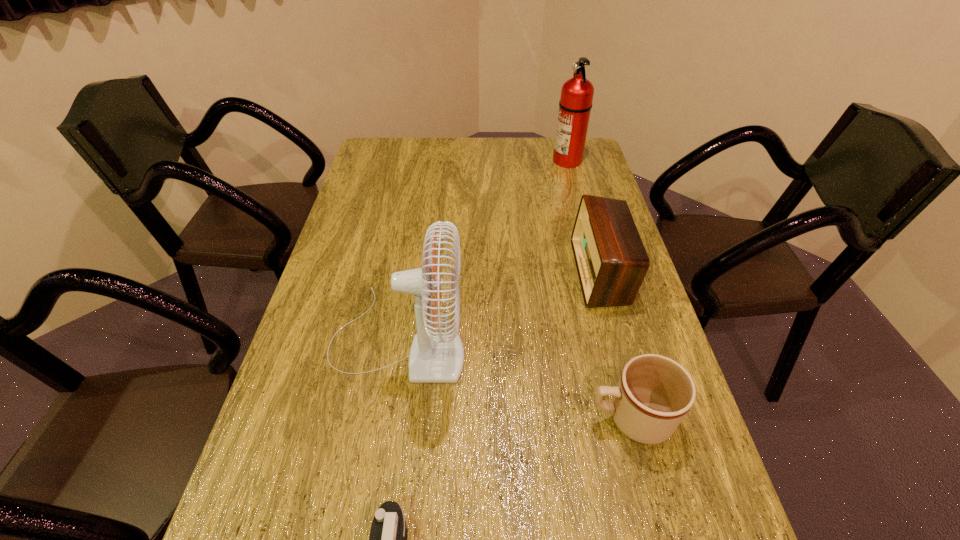
Where is `vacant point located 0.390m on the front-facing side of the radio receiver`? Image resolution: width=960 pixels, height=540 pixels. vacant point located 0.390m on the front-facing side of the radio receiver is located at coordinates (437, 272).

At what (x,y) coordinates should I click in order to perform the action: click on vacant area located on the side of the mug with the handle. Please return your answer as a coordinate pair (x, y). Looking at the image, I should click on (439, 417).

Where is `vacant region located 0.250m on the side of the mug with the handle`? vacant region located 0.250m on the side of the mug with the handle is located at coordinates (468, 417).

At what (x,y) coordinates should I click in order to perform the action: click on vacant space situated on the side of the mug with the handle. Please return your answer as a coordinate pair (x, y). Image resolution: width=960 pixels, height=540 pixels. Looking at the image, I should click on (559, 417).

At what (x,y) coordinates should I click in order to perform the action: click on object positioned at the far edge. Please return your answer as a coordinate pair (x, y). Looking at the image, I should click on (575, 104).

The image size is (960, 540). I want to click on object present at the left edge, so click(x=435, y=357).

Where is `fire extinguisher that is at the right edge`? Image resolution: width=960 pixels, height=540 pixels. fire extinguisher that is at the right edge is located at coordinates (575, 104).

I want to click on radio receiver present at the right edge, so click(611, 260).

Identify the location of mug at the right edge. (654, 393).

Locate an element on the screen. The width and height of the screenshot is (960, 540). object that is at the far right corner is located at coordinates (575, 104).